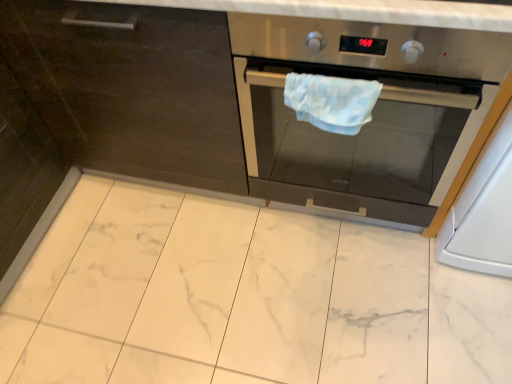
Question: From their relative heights in the image, would you say white glossy oven at right is taller or shorter than light blue fabric hand towel at center?

Choices:
 (A) short
 (B) tall

Answer: (B)

Question: From the image's perspective, is white glossy oven at right above or below light blue fabric hand towel at center?

Choices:
 (A) above
 (B) below

Answer: (B)

Question: Estimate the real-world distances between objects in this image. Which object is closer to the stainless steel oven at center?

Choices:
 (A) white glossy oven at right
 (B) light blue fabric hand towel at center

Answer: (B)

Question: Which of these objects is positioned farthest from the light blue fabric hand towel at center?

Choices:
 (A) white glossy oven at right
 (B) stainless steel oven at center

Answer: (A)